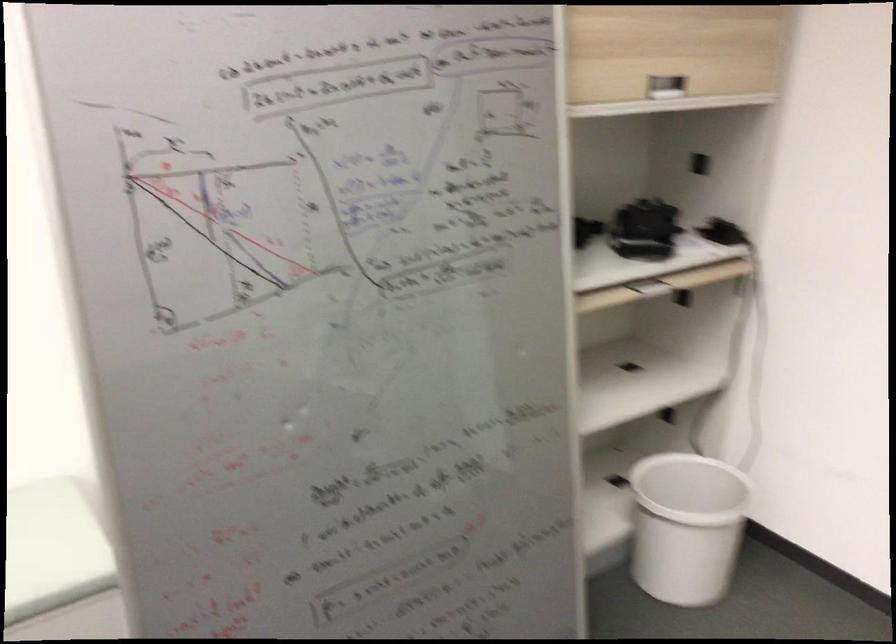
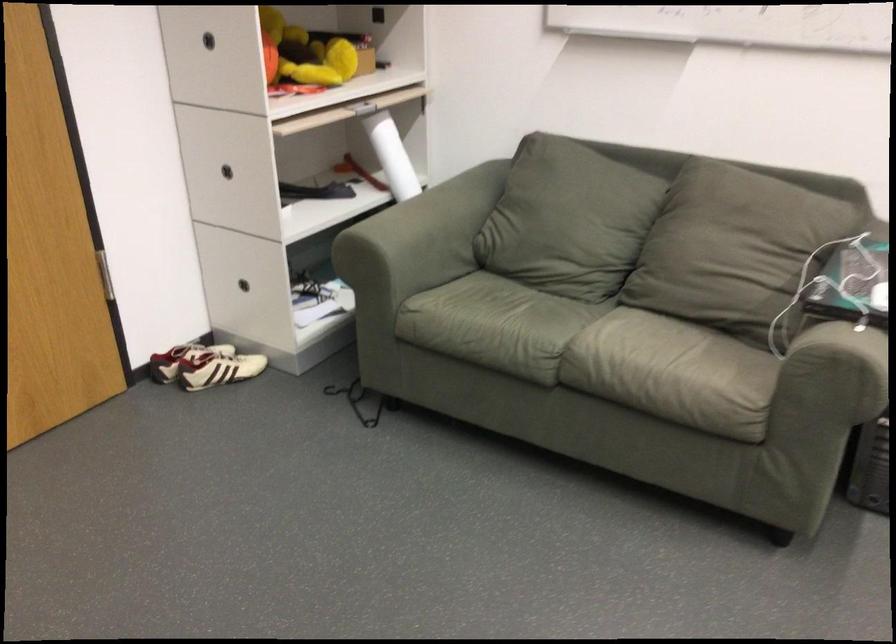
How did the camera likely rotate?

The camera's rotation is toward right-down.